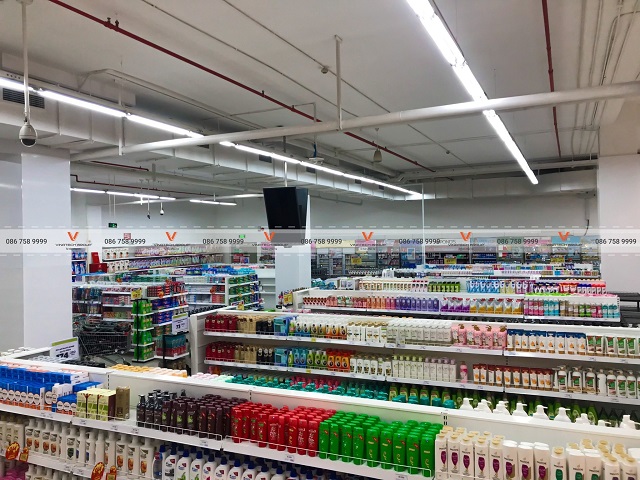
At what (x,y) coordinates should I click in order to perform the action: click on lights. Please return your answer as a coordinate pair (x, y). Looking at the image, I should click on (513, 153), (162, 128), (136, 195).